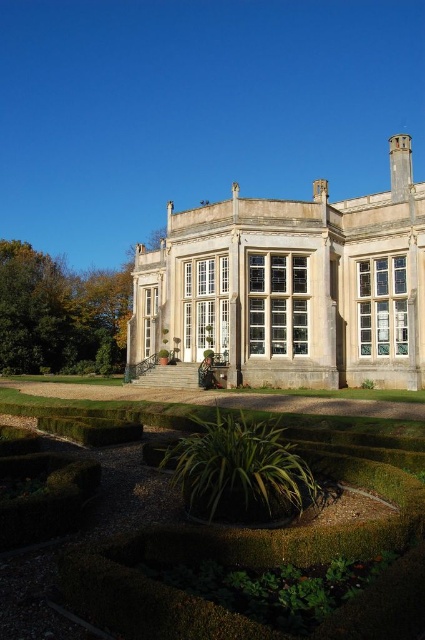
Question: Which of the following is the closest to the observer?

Choices:
 (A) (91, 291)
 (B) (379, 236)
 (C) (240, 467)
 (D) (345, 468)

Answer: (C)

Question: Which point is farther to the camera?

Choices:
 (A) green leafy hedge at lower left
 (B) green leafy hedge at lower center

Answer: (A)

Question: Where is green mossy hedge at lower center located in relation to green leafy hedge at lower left in the image?

Choices:
 (A) below
 (B) above

Answer: (A)

Question: Considering the relative positions of white stone mansion at center and green leafy hedge at lower center in the image provided, where is white stone mansion at center located with respect to green leafy hedge at lower center?

Choices:
 (A) right
 (B) left

Answer: (B)

Question: Which of the following is the closest to the observer?

Choices:
 (A) (413, 372)
 (B) (39, 307)

Answer: (A)

Question: Does white stone mansion at center have a lesser width compared to green leafy hedge at lower left?

Choices:
 (A) no
 (B) yes

Answer: (A)